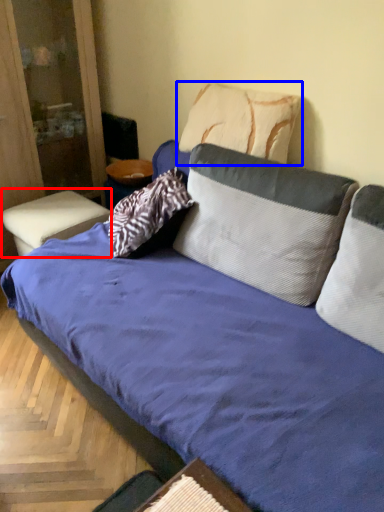
Question: Among these objects, which one is nearest to the camera, table (highlighted by a red box) or pillow (highlighted by a blue box)?

Choices:
 (A) table
 (B) pillow

Answer: (B)